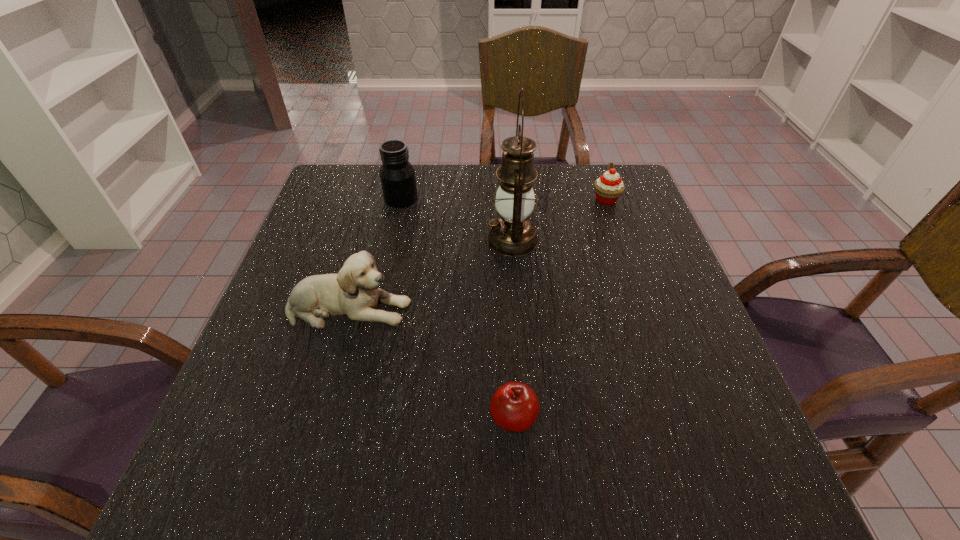
The width and height of the screenshot is (960, 540). Identify the location of vacant space located on the right of the fourth shortest object. (518, 199).

Identify the location of free spot located on the front-facing side of the puppy. This screenshot has width=960, height=540. (463, 308).

Locate an element on the screen. The image size is (960, 540). vacant point located 0.180m on the left of the cupcake is located at coordinates (526, 200).

Locate an element on the screen. The image size is (960, 540). vacant region located 0.230m on the right of the apple is located at coordinates tap(670, 418).

Image resolution: width=960 pixels, height=540 pixels. I want to click on jar located in the far edge section of the desktop, so click(x=397, y=175).

Identify the location of cupcake that is at the far edge. Image resolution: width=960 pixels, height=540 pixels. (608, 188).

At what (x,y) coordinates should I click in order to perform the action: click on object that is at the left edge. Please return your answer as a coordinate pair (x, y). The width and height of the screenshot is (960, 540). Looking at the image, I should click on (354, 292).

Locate an element on the screen. object that is at the right edge is located at coordinates (608, 188).

Image resolution: width=960 pixels, height=540 pixels. I want to click on object situated at the far right corner, so click(608, 188).

Where is `free space at the far edge of the desktop`? This screenshot has height=540, width=960. free space at the far edge of the desktop is located at coordinates (447, 166).